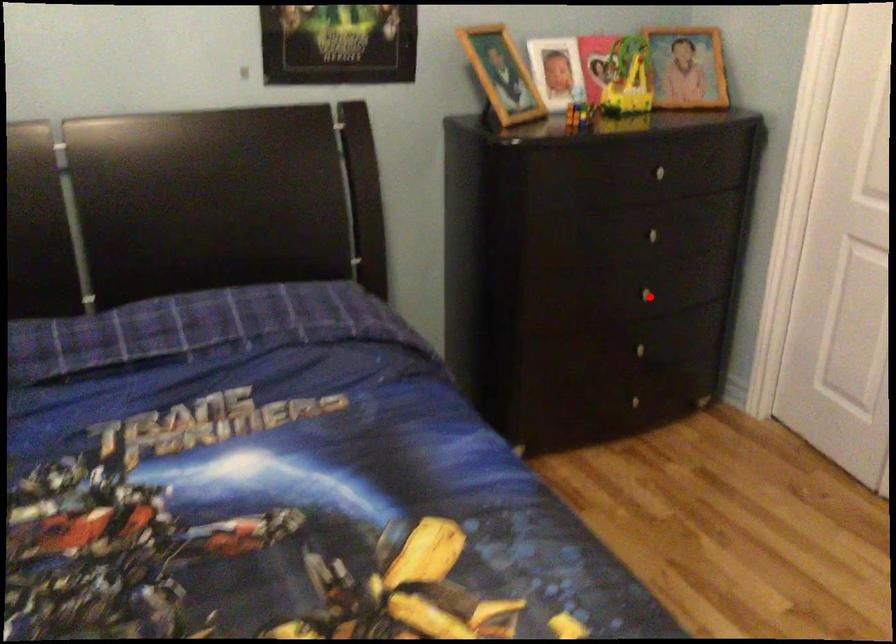
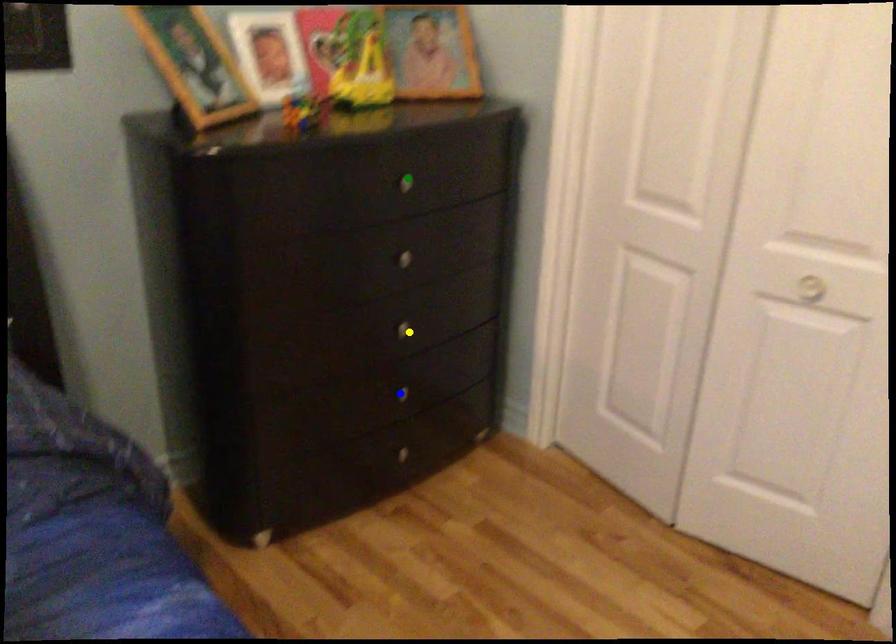
Question: I am providing you with two images of the same scene from different viewpoints. A red point is marked on the first image. You are given multiple points on the second image. In image 2, which mark is for the same physical point as the one in image 1?

Choices:
 (A) green point
 (B) blue point
 (C) yellow point

Answer: (C)